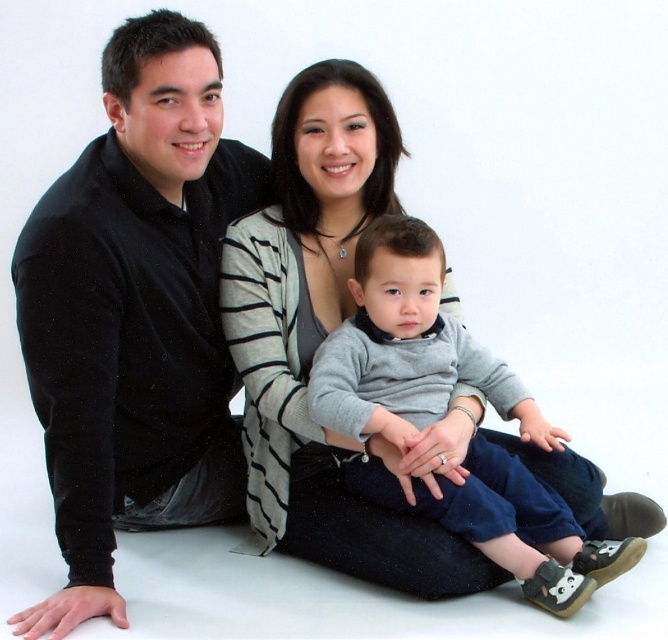
You are a photographer setting up for a family photo. You have two sweaters to place on the family members. The black velvet sweater at left needs to be placed on the father, and the gray soft sweater at center on the mother. The camera is positioned 20 inches away from the father. Can the photographer ensure that the distance between the two sweaters is within the camera frame if the camera frame can capture objects up to 22 inches apart?

The black velvet sweater at left is 18.62 inches from the gray soft sweater at center. Since the camera frame can capture objects up to 22 inches apart and the distance between the sweaters is less than that, the photographer can ensure the distance between the two sweaters is within the camera frame.

You are organizing a clothing donation drive and need to sort items by their position. Which sweater is on the left side between the black velvet sweater at left and the gray soft sweater at center?

The black velvet sweater at left is positioned on the left side of the gray soft sweater at center, so the black velvet sweater at left is the one on the left.